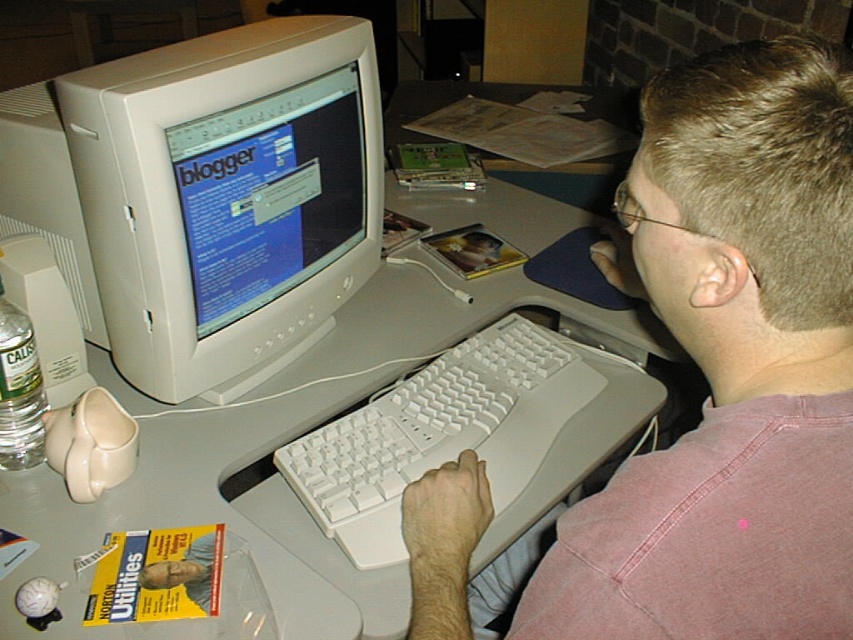
Question: Does pink cotton shirt at upper right have a lesser width compared to white plastic monitor at upper left?

Choices:
 (A) no
 (B) yes

Answer: (B)

Question: Which of the following is the farthest from the observer?

Choices:
 (A) white plastic keyboard at center
 (B) pink cotton shirt at upper right

Answer: (A)

Question: Is white plastic monitor at upper left further to camera compared to white plastic keyboard at center?

Choices:
 (A) no
 (B) yes

Answer: (A)

Question: Which of the following is the farthest from the observer?

Choices:
 (A) white plastic computer desk at center
 (B) white plastic monitor at upper left

Answer: (B)

Question: Is pink cotton shirt at upper right thinner than white plastic computer desk at center?

Choices:
 (A) no
 (B) yes

Answer: (B)

Question: Which of these objects is positioned closest to the matte white monitor at center?

Choices:
 (A) pink cotton shirt at upper right
 (B) white plastic monitor at upper left

Answer: (B)